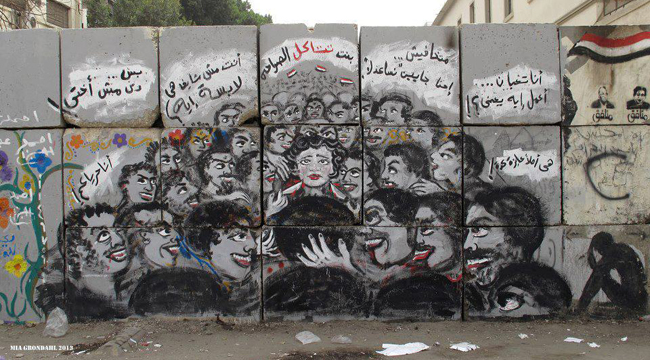
At what (x,y) coordinates should I click in order to perform the action: click on mural. Please return your answer as a coordinate pair (x, y). Looking at the image, I should click on (317, 165).